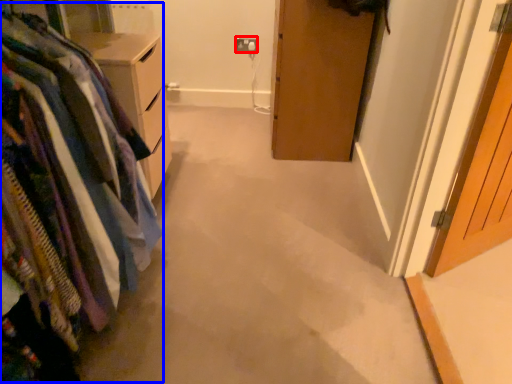
Question: Among these objects, which one is farthest to the camera, electric outlet (highlighted by a red box) or closet (highlighted by a blue box)?

Choices:
 (A) electric outlet
 (B) closet

Answer: (A)